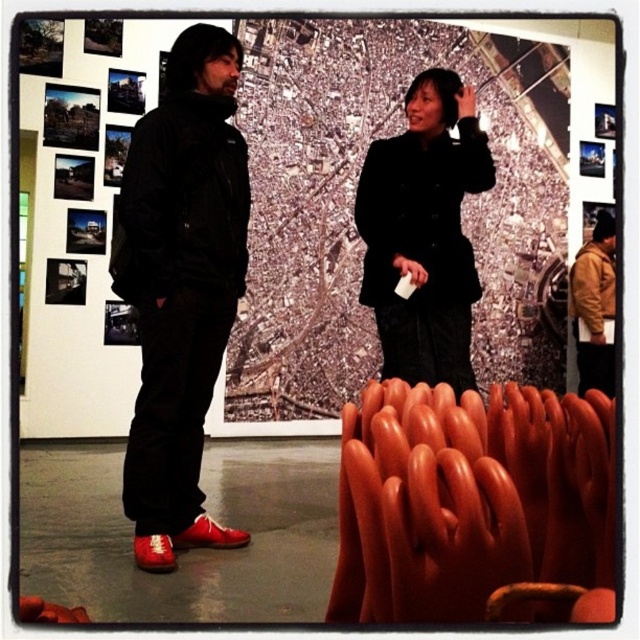
You are an art curator standing at the entrance of the gallery. You need to place a new sculpture exactly at the midpoint between the brown leather jacket at right and the sculpture in the foreground. What are the coordinates of this midpoint?

The midpoint between the brown leather jacket at right and the sculpture in the foreground would be calculated by averaging their coordinates. Since the brown leather jacket at right is at point (595,305), and the sculpture in the foreground is at the origin point (0,0), the midpoint coordinates are (297,152).